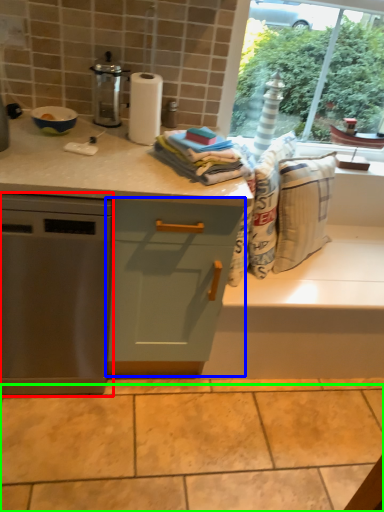
Question: Based on their relative distances, which object is farther from home appliance (highlighted by a red box)? Choose from cabinetry (highlighted by a blue box) and granite (highlighted by a green box).

Choices:
 (A) cabinetry
 (B) granite

Answer: (B)